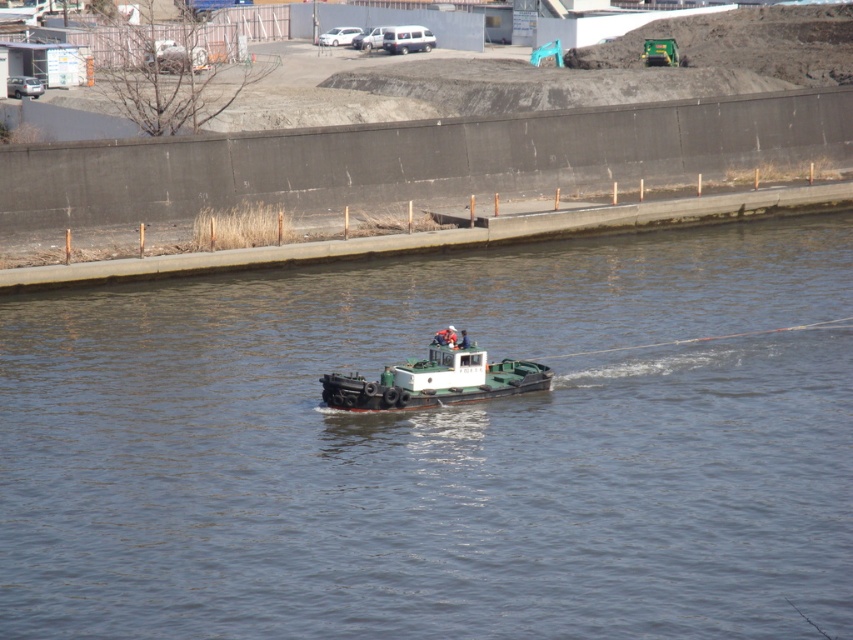
How far apart are green matte boat at center and white matte boat at center?

A distance of 4.29 meters exists between green matte boat at center and white matte boat at center.

Is green matte boat at center to the left of white matte boat at center from the viewer's perspective?

Indeed, green matte boat at center is positioned on the left side of white matte boat at center.

Is point (790, 577) farther from viewer compared to point (527, 378)?

That is False.

This screenshot has height=640, width=853. Find the location of `green matte boat at center`. green matte boat at center is located at coordinates (439, 448).